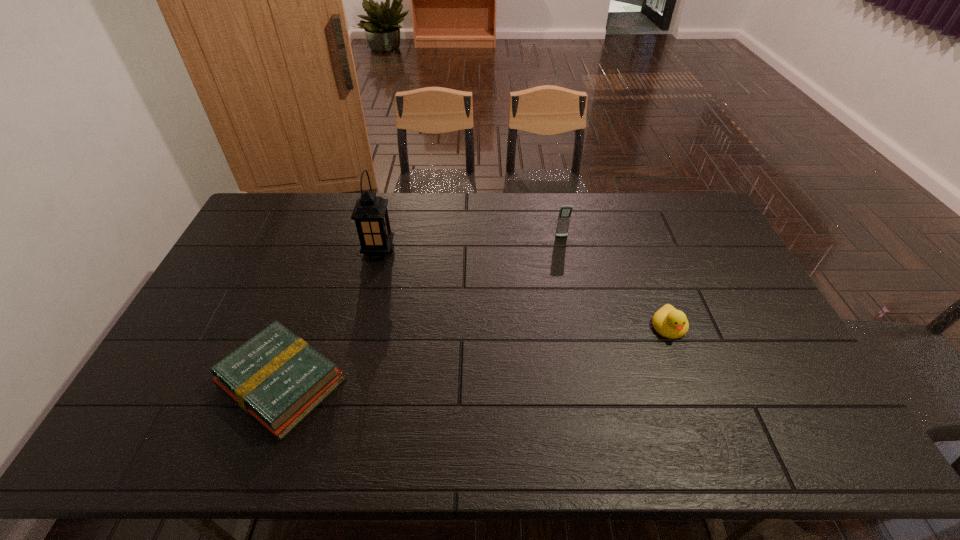
Locate an element on the screen. The height and width of the screenshot is (540, 960). unoccupied position between the second farthest object and the third shortest object is located at coordinates (470, 244).

This screenshot has height=540, width=960. What are the coordinates of `free point between the hardback book and the duckling` in the screenshot? It's located at (475, 355).

The height and width of the screenshot is (540, 960). Identify the location of free spot between the tallest object and the hardback book. (330, 317).

At what (x,y) coordinates should I click in order to perform the action: click on vacant area between the third object from left to right and the third nearest object. Please return your answer as a coordinate pair (x, y). Looking at the image, I should click on (470, 244).

In order to click on empty space that is in between the second farthest object and the cellular telephone in this screenshot , I will do `click(470, 244)`.

You are a GUI agent. You are given a task and a screenshot of the screen. Output one action in this format:
    pyautogui.click(x=<x>, y=<y>)
    Task: Click on the free space between the duckling and the tallest object
    
    Given the screenshot: What is the action you would take?
    pyautogui.click(x=524, y=289)

You are a GUI agent. You are given a task and a screenshot of the screen. Output one action in this format:
    pyautogui.click(x=<x>, y=<y>)
    Task: Click on the free space between the hardback book and the cellular telephone
    Image resolution: width=960 pixels, height=540 pixels.
    Given the screenshot: What is the action you would take?
    pyautogui.click(x=421, y=310)

Where is `vacant area that lies between the hardback book and the tallest object`? Image resolution: width=960 pixels, height=540 pixels. vacant area that lies between the hardback book and the tallest object is located at coordinates (330, 317).

Where is `free spot between the second farthest object and the cellular telephone`? This screenshot has width=960, height=540. free spot between the second farthest object and the cellular telephone is located at coordinates (470, 244).

Where is `the third closest object to the rightmost object`? the third closest object to the rightmost object is located at coordinates (276, 377).